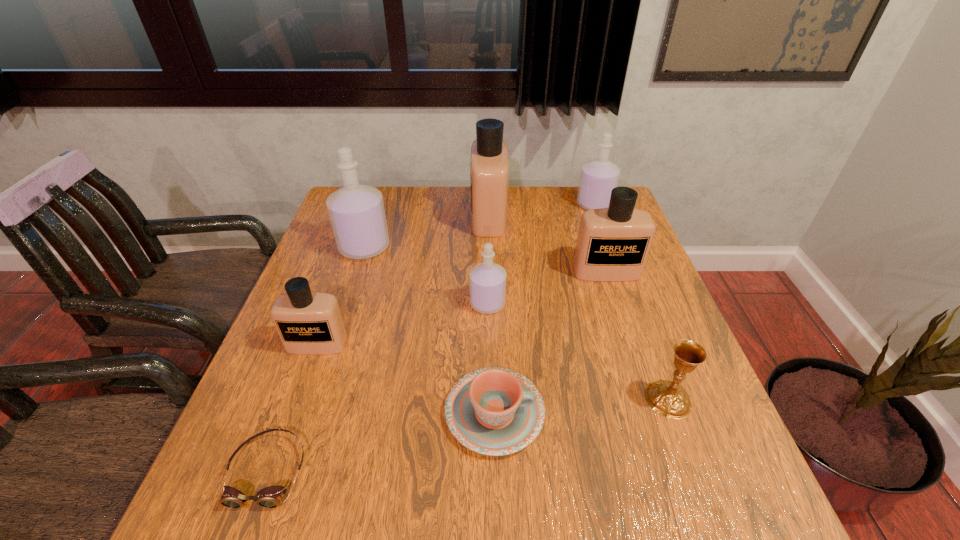
Where is `the nearest perfume`? the nearest perfume is located at coordinates pyautogui.click(x=309, y=323).

Find the location of a particular element. The width and height of the screenshot is (960, 540). the nearest beige perfume is located at coordinates (309, 323).

Find the location of a particular element. gold chalice is located at coordinates (669, 398).

This screenshot has width=960, height=540. Identify the location of chalice. (669, 398).

At what (x,y) coordinates should I click in order to perform the action: click on chinaware. Please return your answer as a coordinate pair (x, y). The width and height of the screenshot is (960, 540). Looking at the image, I should click on (494, 411).

Locate an element on the screen. the eighth tallest object is located at coordinates (494, 411).

Locate an element on the screen. goggles is located at coordinates (270, 497).

The image size is (960, 540). Identify the location of free location located 0.090m on the front label of the farthest beige perfume. (443, 217).

The width and height of the screenshot is (960, 540). What are the coordinates of `vacant region located on the front label of the farthest beige perfume` in the screenshot? It's located at (378, 217).

The image size is (960, 540). Identify the location of free space located 0.390m on the front label of the farthest beige perfume. (347, 217).